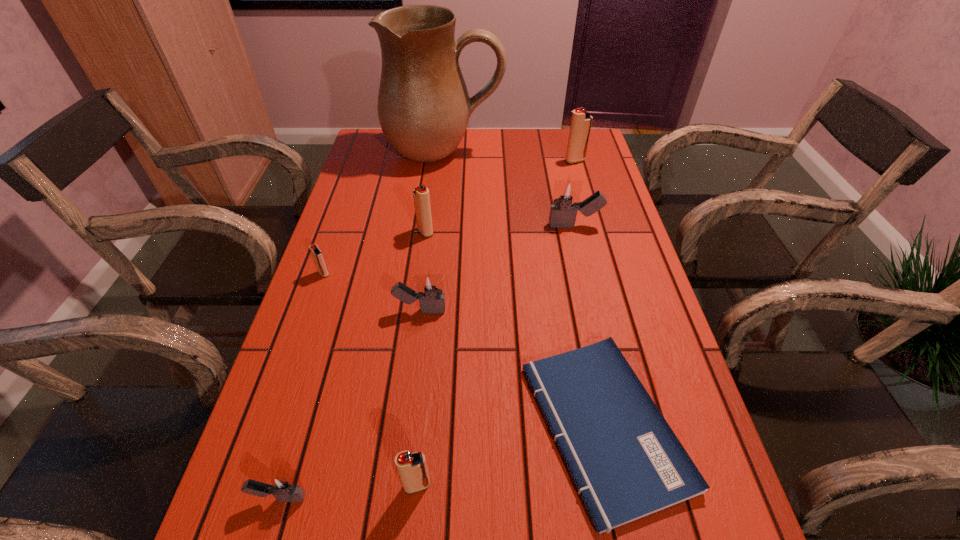
The height and width of the screenshot is (540, 960). Identify the location of unoccupied area between the blue paperback book and the biggest gray igniter. (589, 326).

What are the coordinates of `empty space between the fifth farthest igniter and the third nearest red igniter` in the screenshot? It's located at (422, 271).

This screenshot has width=960, height=540. Find the location of `free space between the second gray igniter from left to right and the second nearest red igniter`. free space between the second gray igniter from left to right and the second nearest red igniter is located at coordinates (372, 292).

Locate an element on the screen. The width and height of the screenshot is (960, 540). object that is the fifth closest one to the second nearest red igniter is located at coordinates (626, 462).

The width and height of the screenshot is (960, 540). I want to click on object that stands as the fourth closest to the cream pitcher, so click(x=318, y=257).

Identify which igniter is the closest to the second nearest gray igniter. Please provide its 2D coordinates. Your answer should be formatted as a tuple, i.e. [(x, y)], where the tuple contains the x and y coordinates of a point satisfying the conditions above.

[(318, 257)]

Identify which igniter is located as the fifth nearest to the second gray igniter from right to left. Please provide its 2D coordinates. Your answer should be formatted as a tuple, i.e. [(x, y)], where the tuple contains the x and y coordinates of a point satisfying the conditions above.

[(281, 487)]

Where is `red igniter that is the third closest one to the second biggest red igniter`? This screenshot has height=540, width=960. red igniter that is the third closest one to the second biggest red igniter is located at coordinates (412, 468).

Identify the location of red igniter identified as the fourth closest to the second smallest gray igniter. The image size is (960, 540). (581, 121).

Locate an element on the screen. The width and height of the screenshot is (960, 540). the third closest gray igniter to the tallest object is located at coordinates (281, 487).